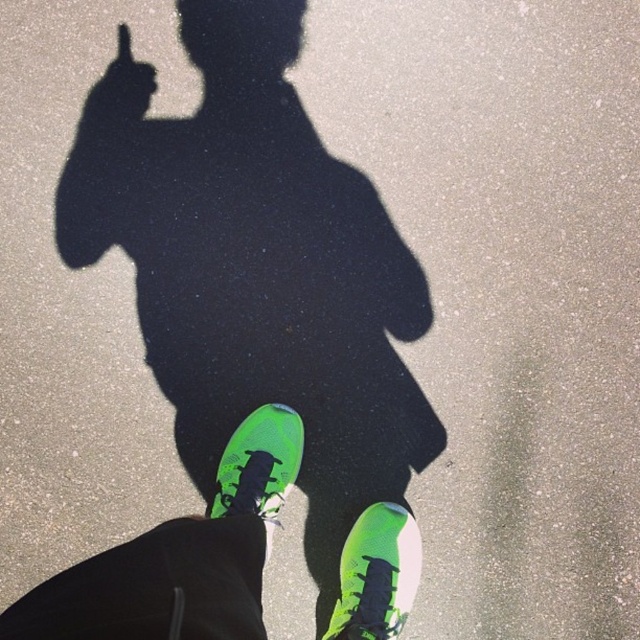
You are standing in the scene and want to move from your current position to the point marked as point (116, 60). However, there is an obstacle at point (397, 573). Can you walk straight towards your destination without encountering the obstacle first?

Since point (397, 573) is in front of point (116, 60), walking straight towards point (116, 60) would first lead you to encounter the obstacle at point (397, 573) before reaching the destination.

You are trying to decide whether to place a small object between the neon green sneakers at center and the green matte hand at upper left. Based on their sizes, which one has a larger width?

The neon green sneakers at center might be wider than green matte hand at upper left according to the description.